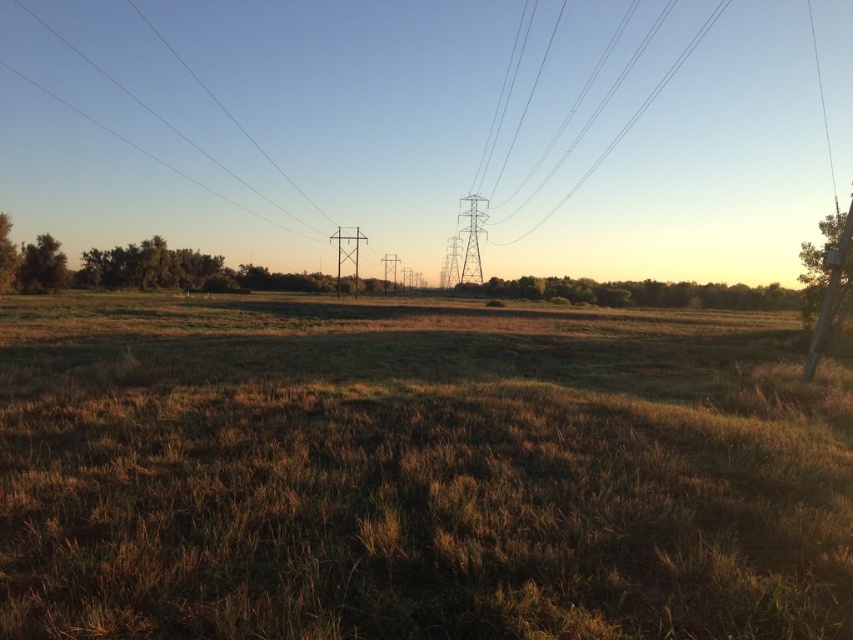
Question: Based on their relative distances, which object is nearer to the green leafy tree at left?

Choices:
 (A) black wire at upper center
 (B) green leafy tree at right
 (C) brown dry grass at center

Answer: (C)

Question: Where is brown dry grass at center located in relation to green leafy tree at left in the image?

Choices:
 (A) above
 (B) below

Answer: (B)

Question: Which point is farther from the camera taking this photo?

Choices:
 (A) (38, 236)
 (B) (828, 246)
 (C) (479, 346)
 (D) (612, 145)

Answer: (D)

Question: Does brown dry grass at center lie behind black wire at upper center?

Choices:
 (A) no
 (B) yes

Answer: (A)

Question: Which object is the closest to the green leafy tree at left?

Choices:
 (A) brown dry grass at center
 (B) green leafy tree at right

Answer: (A)

Question: Does brown dry grass at center appear under green leafy tree at left?

Choices:
 (A) yes
 (B) no

Answer: (A)